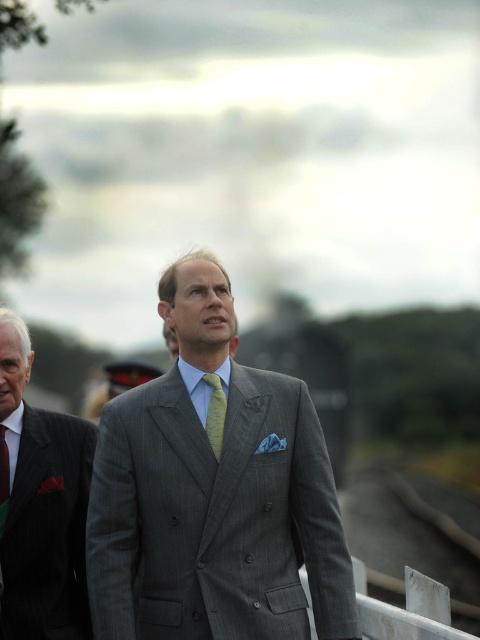
Who is positioned more to the right, dark gray pinstripe suit at center or yellow silk tie at left?

dark gray pinstripe suit at center is more to the right.

Can you confirm if dark gray pinstripe suit at center is shorter than yellow silk tie at left?

Incorrect, dark gray pinstripe suit at center's height does not fall short of yellow silk tie at left's.

Between point (6, 369) and point (9, 465), which one is positioned in front?

Point (6, 369) is more forward.

Where is `dark gray pinstripe suit at center`? This screenshot has height=640, width=480. dark gray pinstripe suit at center is located at coordinates (41, 508).

Describe the element at coordinates (403, 541) in the screenshot. I see `white wood train track at lower right` at that location.

Is white wood train track at lower right bigger than yellow silk tie at left?

Yes.

What do you see at coordinates (403, 541) in the screenshot? The height and width of the screenshot is (640, 480). I see `white wood train track at lower right` at bounding box center [403, 541].

Image resolution: width=480 pixels, height=640 pixels. Find the location of `white wood train track at lower right`. white wood train track at lower right is located at coordinates (403, 541).

Can you confirm if gray pinstripe suit at center is positioned to the left of dark gray pinstripe suit at center?

In fact, gray pinstripe suit at center is to the right of dark gray pinstripe suit at center.

Which of these two, gray pinstripe suit at center or dark gray pinstripe suit at center, stands shorter?

Standing shorter between the two is dark gray pinstripe suit at center.

Measure the distance between point [335,518] and camera.

A distance of 19.82 feet exists between point [335,518] and camera.

You are a GUI agent. You are given a task and a screenshot of the screen. Output one action in this format:
    pyautogui.click(x=<x>, y=<y>)
    Task: Click on the gray pinstripe suit at center
    The height and width of the screenshot is (640, 480).
    Given the screenshot: What is the action you would take?
    pyautogui.click(x=214, y=493)